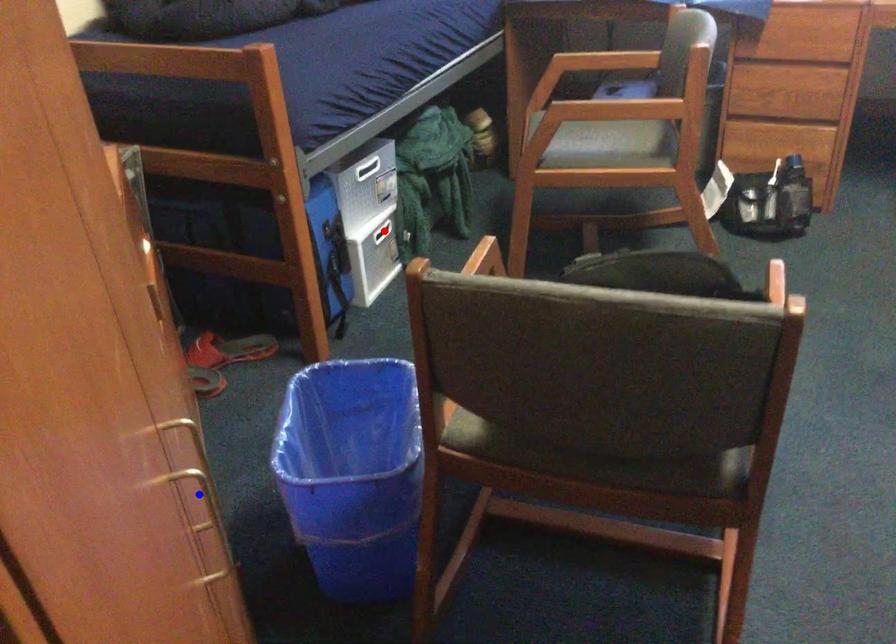
Question: Which of the two points in the image is closer to the camera?

Choices:
 (A) Blue point is closer.
 (B) Red point is closer.

Answer: (A)